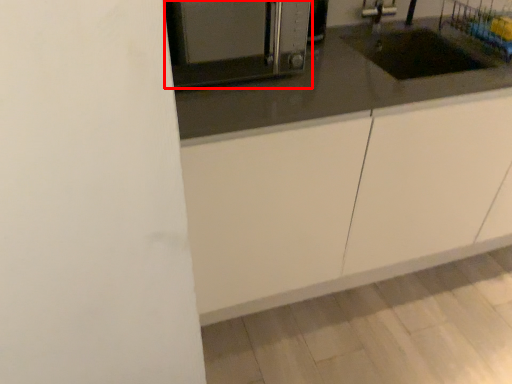
Question: From the image, what is the correct spatial relationship of home appliance (annotated by the red box) in relation to cabinetry?

Choices:
 (A) right
 (B) left

Answer: (B)